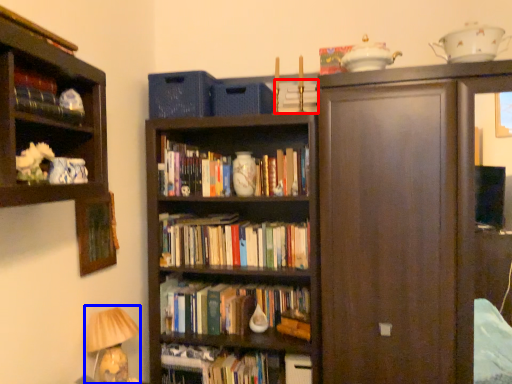
Question: Which object is further to the camera taking this photo, book (highlighted by a red box) or table lamp (highlighted by a blue box)?

Choices:
 (A) book
 (B) table lamp

Answer: (A)